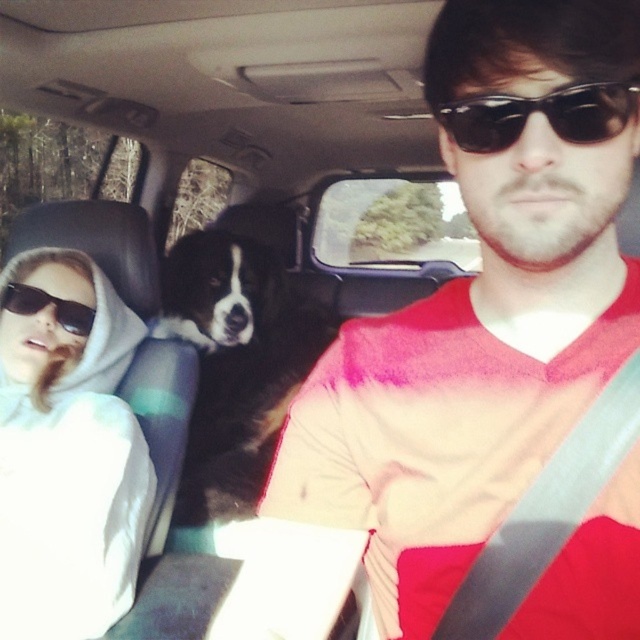
You are sitting in the back seat of the car and want to know which point is closer to you. The points are point (17, 596) and point (580, 122). Which one is closer to your position?

Point (17, 596) is closer to you because it is further to the camera than point (580, 122). Since you are in the back seat, the point closer to the camera would also be closer to you.

You are a passenger in the car and want to know which object is bigger between the black fur dog at center and the black plastic sunglasses at upper center. Can you tell me?

The black fur dog at center is larger in size than the black plastic sunglasses at upper center.